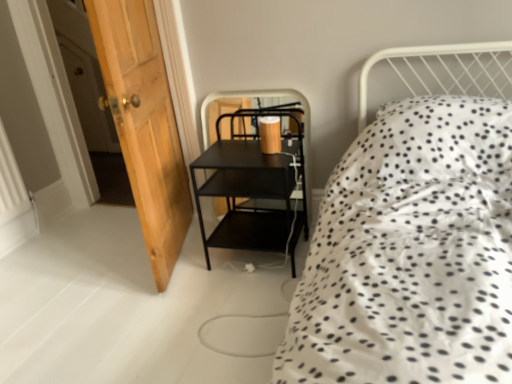
Question: From the image's perspective, is wooden door at left above or below black metal shelf at center?

Choices:
 (A) above
 (B) below

Answer: (A)

Question: Looking at their shapes, would you say wooden door at left is wider or thinner than black metal shelf at center?

Choices:
 (A) thin
 (B) wide

Answer: (B)

Question: From a real-world perspective, is wooden door at left physically located above or below black metal shelf at center?

Choices:
 (A) above
 (B) below

Answer: (A)

Question: Is black metal shelf at center to the left or to the right of wooden door at left in the image?

Choices:
 (A) right
 (B) left

Answer: (A)

Question: Is black metal shelf at center wider or thinner than wooden door at left?

Choices:
 (A) wide
 (B) thin

Answer: (B)

Question: Is point (200, 223) closer or farther from the camera than point (106, 59)?

Choices:
 (A) farther
 (B) closer

Answer: (A)

Question: Is black metal shelf at center inside the boundaries of wooden door at left, or outside?

Choices:
 (A) inside
 (B) outside

Answer: (B)